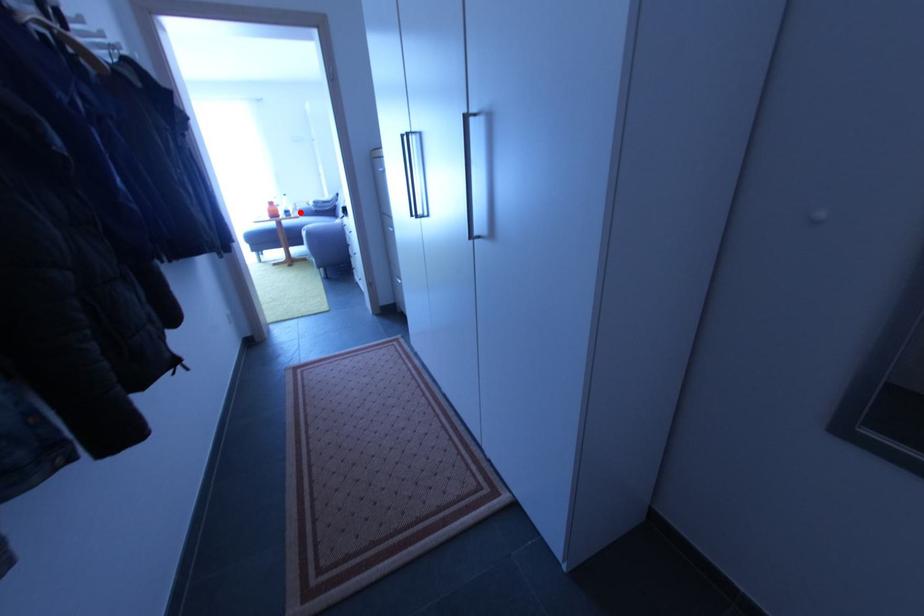
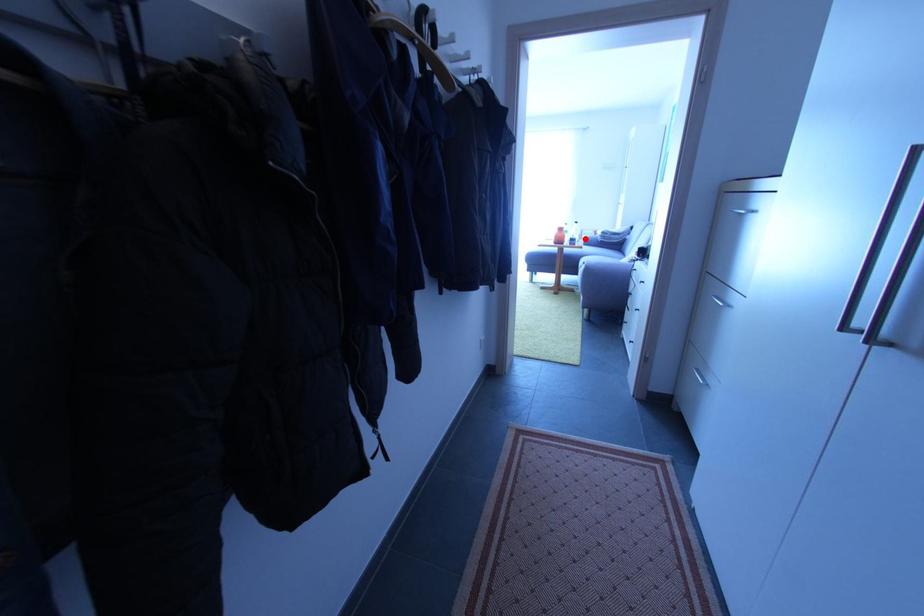
I am providing you with two images of the same scene from different viewpoints. A red point is marked on the first image and another point is marked on the second image. Does the point marked in image1 correspond to the same location as the one in image2?

Yes